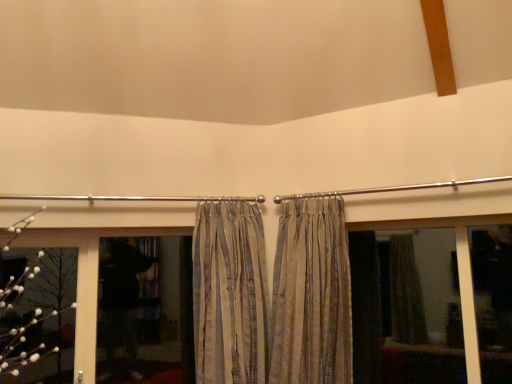
Question: Is matte glass window at center smaller than silky beige curtains at center, the first curtain in the right-to-left sequence?

Choices:
 (A) yes
 (B) no

Answer: (A)

Question: Can silky beige curtains at center, which is the second curtain from left to right, be found inside matte glass window at center?

Choices:
 (A) no
 (B) yes

Answer: (A)

Question: From a real-world perspective, is matte glass window at center physically below silky beige curtains at center, the first curtain in the right-to-left sequence?

Choices:
 (A) no
 (B) yes

Answer: (B)

Question: Is the position of matte glass window at center more distant than that of silky beige curtains at center, the first curtain in the right-to-left sequence?

Choices:
 (A) yes
 (B) no

Answer: (A)

Question: Does matte glass window at center appear on the left side of silky beige curtains at center, the first curtain in the right-to-left sequence?

Choices:
 (A) no
 (B) yes

Answer: (A)

Question: Relative to striped fabric curtain at center, placed as the first curtain when sorted from left to right, is silky beige curtains at center, the first curtain in the right-to-left sequence, in front or behind?

Choices:
 (A) front
 (B) behind

Answer: (B)

Question: Considering the positions of point (242, 256) and point (205, 344), is point (242, 256) closer or farther from the camera than point (205, 344)?

Choices:
 (A) farther
 (B) closer

Answer: (A)

Question: In terms of height, does silky beige curtains at center, the first curtain in the right-to-left sequence, look taller or shorter compared to striped fabric curtain at center, placed as the second curtain when sorted from right to left?

Choices:
 (A) short
 (B) tall

Answer: (A)

Question: In terms of width, does silky beige curtains at center, the first curtain in the right-to-left sequence, look wider or thinner when compared to striped fabric curtain at center, placed as the first curtain when sorted from left to right?

Choices:
 (A) thin
 (B) wide

Answer: (A)

Question: Would you say dark glass window at lower left is inside or outside striped fabric curtain at center, placed as the second curtain when sorted from right to left?

Choices:
 (A) inside
 (B) outside

Answer: (B)

Question: In terms of height, does dark glass window at lower left look taller or shorter compared to striped fabric curtain at center, placed as the second curtain when sorted from right to left?

Choices:
 (A) tall
 (B) short

Answer: (B)

Question: Is dark glass window at lower left bigger or smaller than striped fabric curtain at center, placed as the first curtain when sorted from left to right?

Choices:
 (A) big
 (B) small

Answer: (B)

Question: From the image's perspective, is dark glass window at lower left positioned above or below striped fabric curtain at center, placed as the first curtain when sorted from left to right?

Choices:
 (A) below
 (B) above

Answer: (A)

Question: Is point (178, 264) closer or farther from the camera than point (260, 246)?

Choices:
 (A) farther
 (B) closer

Answer: (A)

Question: Is black matte screen door at center in front of or behind striped fabric curtain at center, placed as the first curtain when sorted from left to right, in the image?

Choices:
 (A) behind
 (B) front

Answer: (A)